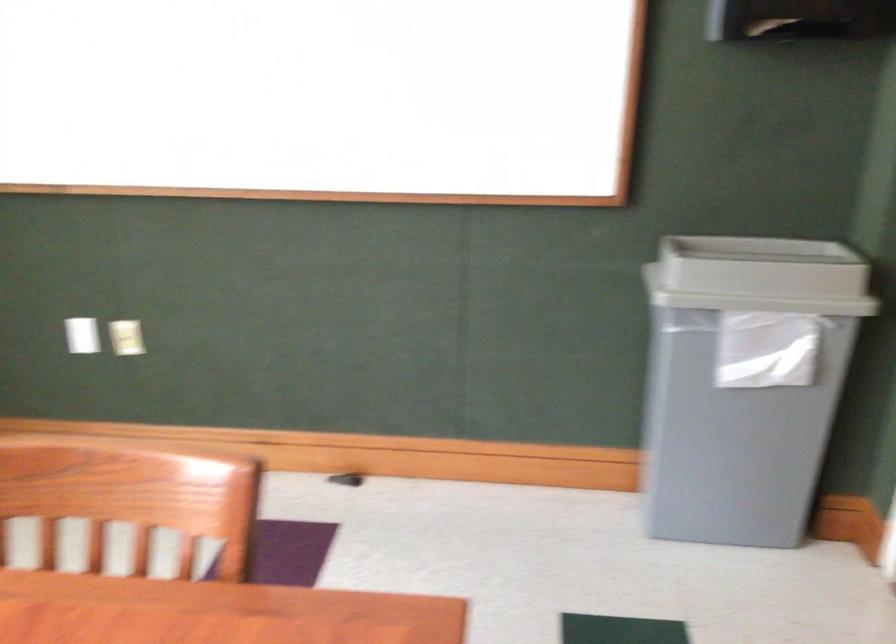
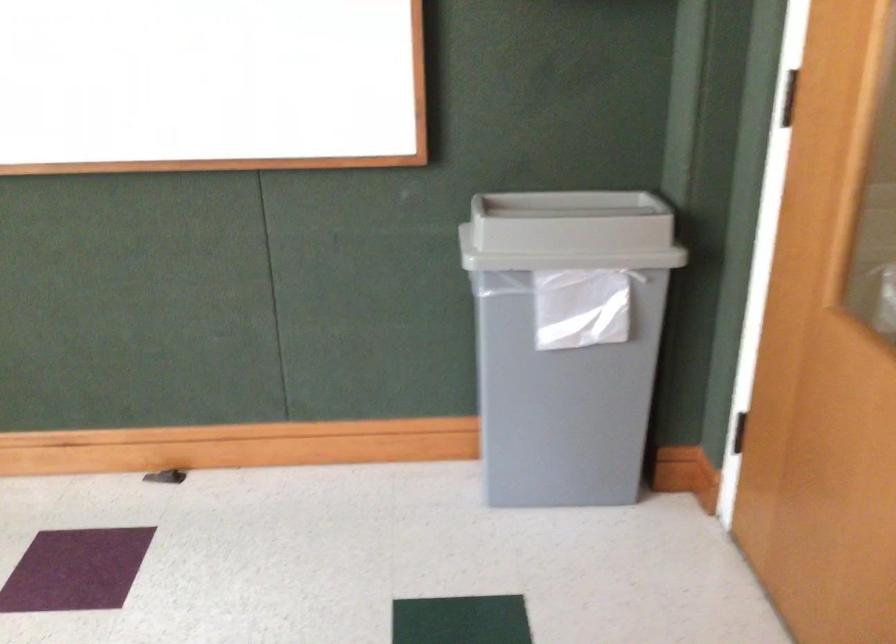
Question: Based on the continuous images, in which direction is the camera rotating? Reply with the corresponding letter.

Choices:
 (A) Left
 (B) Right
 (C) Up
 (D) Down

Answer: (B)